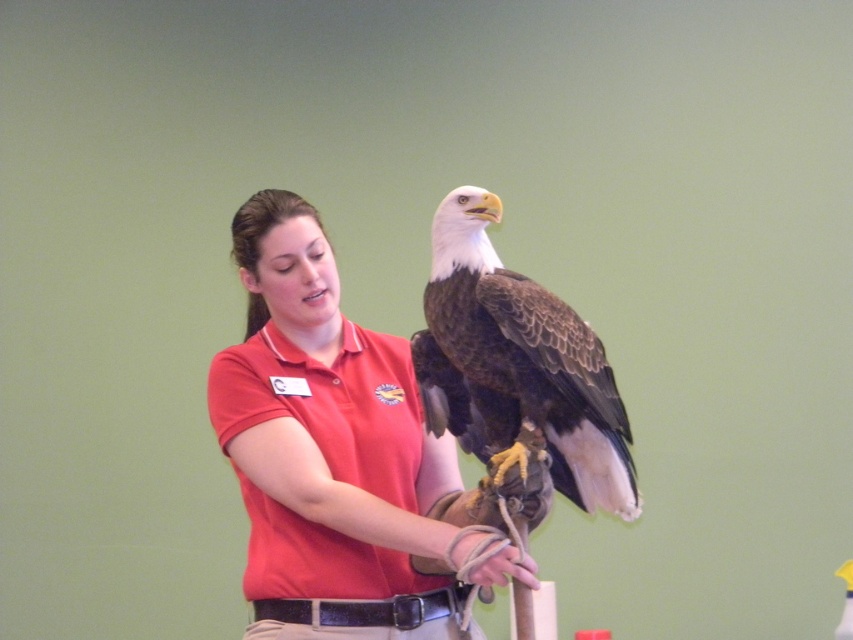
You are a wildlife photographer preparing to take a photo of the brown feathered eagle at center and the leather glove at center. Based on their sizes, which object should you focus on first if you want to ensure both are in frame without zooming in or out?

The brown feathered eagle at center is taller than the leather glove at center, so you should focus on the eagle first to ensure it fits within the frame before adjusting for the smaller glove.

You are a costume designer preparing for a play. You need to ensure that the matte red shirt at center will fit over the leather glove at center. Based on the scene description, can you confirm if the shirt is long enough to cover the glove?

The matte red shirt at center is taller than the leather glove at center, so the shirt should be long enough to cover the glove.